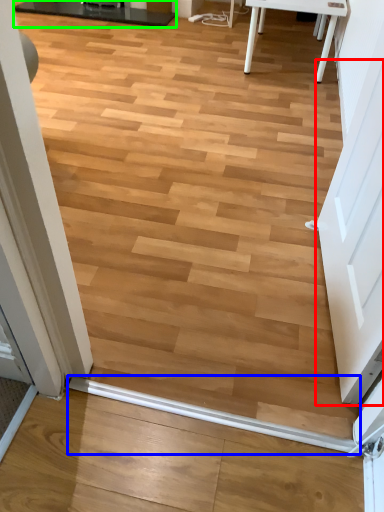
Question: Which object is positioned closest to screen door (highlighted by a red box)? Select from beam (highlighted by a blue box) and table (highlighted by a green box).

Choices:
 (A) beam
 (B) table

Answer: (A)